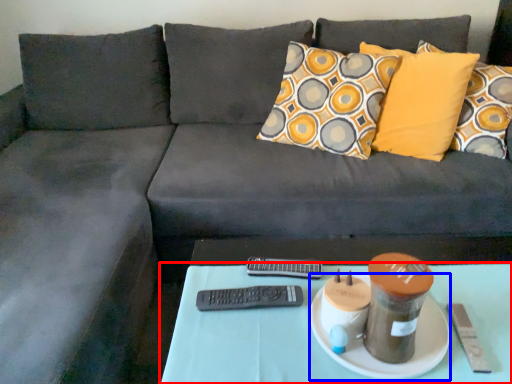
Question: Which object is closer to the camera taking this photo, table (highlighted by a red box) or plate (highlighted by a blue box)?

Choices:
 (A) table
 (B) plate

Answer: (A)